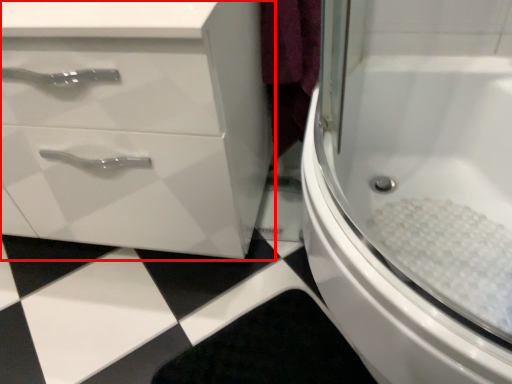
Question: Observing the image, what is the correct spatial positioning of bathroom cabinet (annotated by the red box) in reference to bath?

Choices:
 (A) left
 (B) right

Answer: (A)